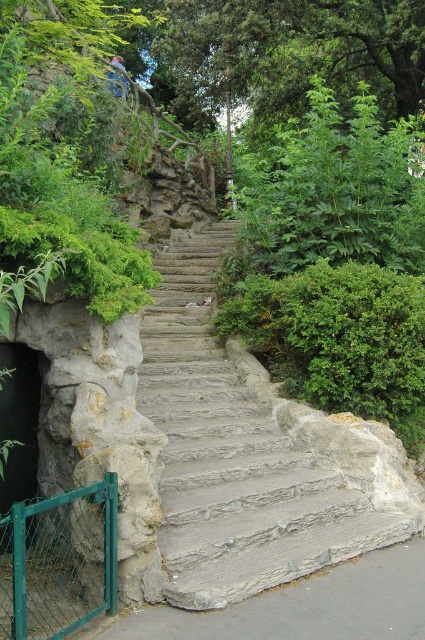
You are standing at the bottom of the stone staircase and want to reach the green leafy bush at upper left and the dark gray stone entrance at left. Which object is closer to you?

The green leafy bush at upper left is closer to the viewer than the dark gray stone entrance at left.

You are standing at the bottom of the stone staircase and want to place a small garden ornament exactly where the green leafy bush at upper left is located. What are the coordinates of that location?

The coordinates of the green leafy bush at upper left are point (67, 163).

You are standing at the bottom of the stone staircase and want to place a small decorative statue exactly at the location of the green leafy bush at upper left. What are the coordinates where you should place it?

The green leafy bush at upper left is located at coordinates point [67,163], so you should place the statue at point [67,163].